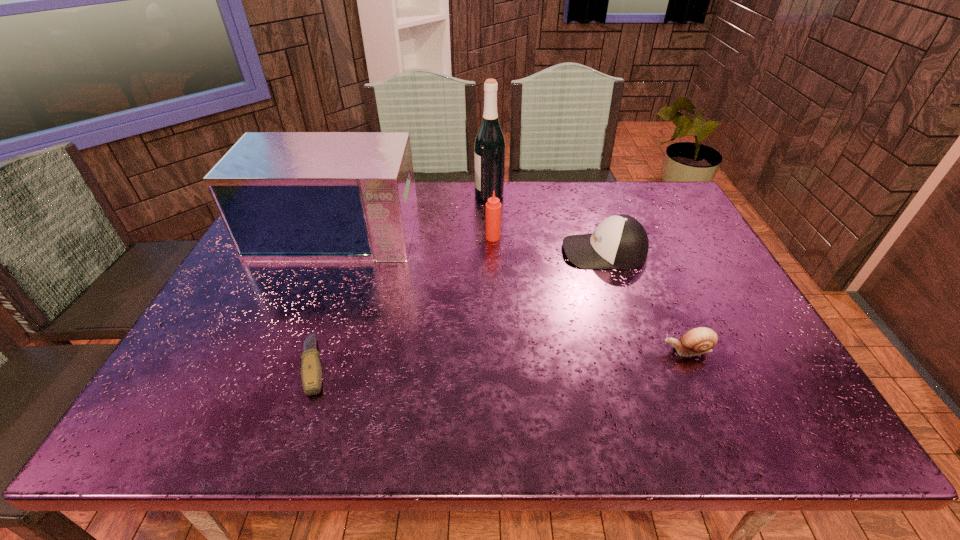
Where is `free location located 0.110m on the back of the third tallest object`? This screenshot has width=960, height=540. free location located 0.110m on the back of the third tallest object is located at coordinates (492, 212).

You are a GUI agent. You are given a task and a screenshot of the screen. Output one action in this format:
    pyautogui.click(x=<x>, y=<y>)
    Task: Click on the vacant space located 0.350m on the front panel of the fourth tallest object
    
    Given the screenshot: What is the action you would take?
    pyautogui.click(x=440, y=252)

The height and width of the screenshot is (540, 960). Find the location of `free location located 0.240m on the front panel of the fourth tallest object`. free location located 0.240m on the front panel of the fourth tallest object is located at coordinates (478, 252).

Where is `vacant space situated on the front panel of the fourth tallest object`? This screenshot has width=960, height=540. vacant space situated on the front panel of the fourth tallest object is located at coordinates (535, 252).

Find the location of `free space located on the front-facing side of the second shortest object`. free space located on the front-facing side of the second shortest object is located at coordinates (564, 350).

Locate an element on the screen. vacant region located on the front-facing side of the second shortest object is located at coordinates (586, 350).

Find the location of a particular element. Image resolution: width=960 pixels, height=540 pixels. vacant point located on the front-facing side of the second shortest object is located at coordinates (599, 350).

The image size is (960, 540). Identify the location of free spot located 0.060m on the back of the pocketknife. (331, 316).

Where is `wine bottle present at the far edge`? This screenshot has height=540, width=960. wine bottle present at the far edge is located at coordinates (489, 148).

Locate an element on the screen. microwave oven that is at the far edge is located at coordinates (282, 196).